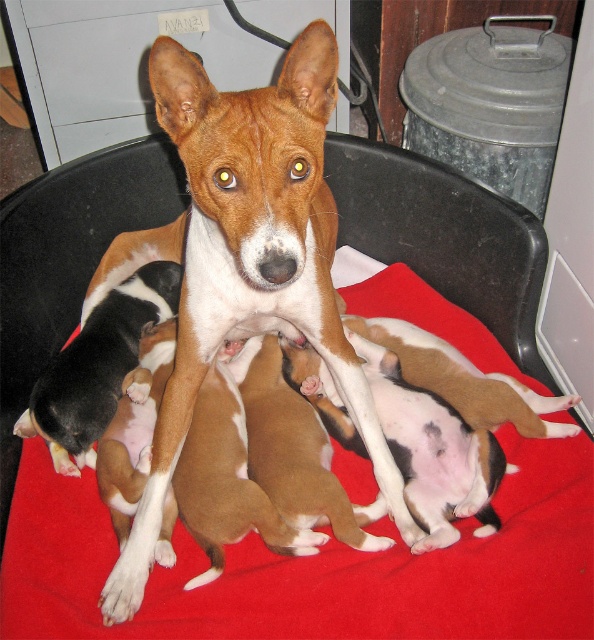
Is galvanized metal trash can at upper right smaller than black and white fur at center?

No, galvanized metal trash can at upper right is not smaller than black and white fur at center.

Is point (519, 88) positioned behind point (31, 401)?

Yes, it is.

What are the coordinates of `galvanized metal trash can at upper right` in the screenshot? It's located at coord(491,104).

What do you see at coordinates (242, 259) in the screenshot?
I see `brown and white fur at center` at bounding box center [242, 259].

Which of these two, brown and white fur at center or black and white fur at center, stands shorter?

black and white fur at center

The width and height of the screenshot is (594, 640). Describe the element at coordinates (242, 259) in the screenshot. I see `brown and white fur at center` at that location.

Find the location of `brown and white fur at center`. brown and white fur at center is located at coordinates (242, 259).

Does red fabric blanket at center have a smaller size compared to brown and white fur at center?

No.

Can you confirm if red fabric blanket at center is taller than brown and white fur at center?

Incorrect, red fabric blanket at center's height is not larger of brown and white fur at center's.

Is point (561, 602) positioned after point (258, 180)?

Yes.

Image resolution: width=594 pixels, height=640 pixels. Find the location of `red fabric blanket at center`. red fabric blanket at center is located at coordinates (317, 566).